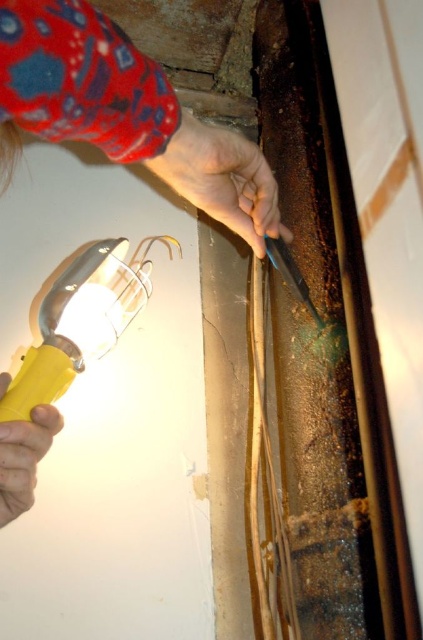
You are a construction worker assessing the scene. You notice the matte fabric hand at upper center and the yellow plastic flashlight at lower left. Which object is positioned higher in the image?

The matte fabric hand at upper center is positioned higher than the yellow plastic flashlight at lower left.

From the picture: You are a worker inspecting the wall. You notice the smooth skin hand at upper center and the yellow plastic flashlight at lower left. Which object is larger in size?

The smooth skin hand at upper center is bigger than the yellow plastic flashlight at lower left.

You are a worker trying to determine the best way to hold your tools. Given the image, which object is wider, the matte fabric hand at upper center or the yellow plastic flashlight at lower left?

The matte fabric hand at upper center might be wider than the yellow plastic flashlight at lower left according to the description.